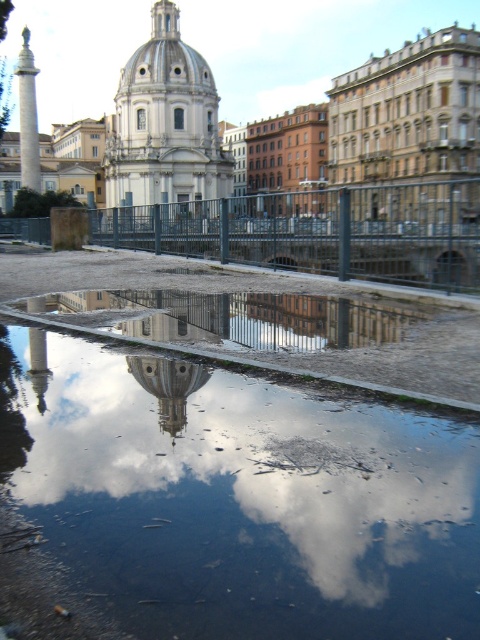
Question: Based on their relative distances, which object is farther from the white glossy dome at center?

Choices:
 (A) polished marble column at left
 (B) transparent water at center

Answer: (A)

Question: Which point is closer to the camera taking this photo?

Choices:
 (A) (34, 168)
 (B) (156, 376)

Answer: (B)

Question: Estimate the real-world distances between objects in this image. Which object is farther from the white glossy dome at center?

Choices:
 (A) polished marble column at left
 (B) transparent water at center

Answer: (A)

Question: Is transparent water at center below white glossy dome at center?

Choices:
 (A) yes
 (B) no

Answer: (A)

Question: In this image, where is transparent water at center located relative to polished marble column at left?

Choices:
 (A) right
 (B) left

Answer: (A)

Question: Does transparent water at center have a smaller size compared to white glossy dome at center?

Choices:
 (A) no
 (B) yes

Answer: (A)